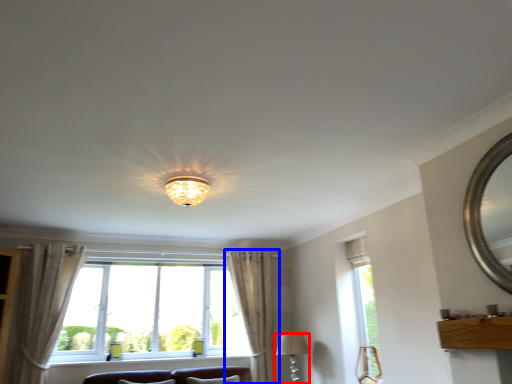
Question: Which point is closer to the camera, lamp (highlighted by a red box) or curtain (highlighted by a blue box)?

Choices:
 (A) lamp
 (B) curtain

Answer: (A)